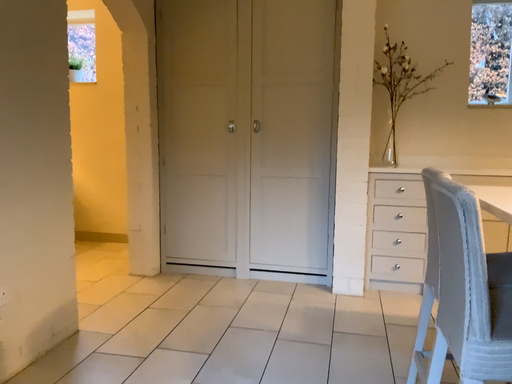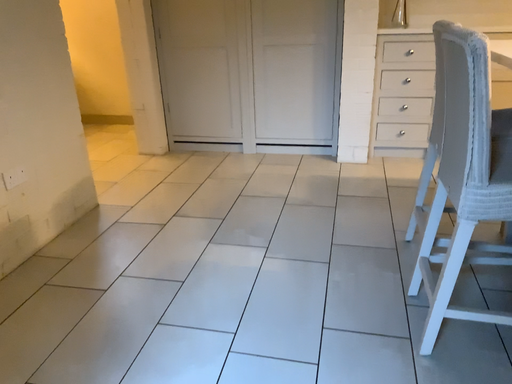
Question: How did the camera likely rotate when shooting the video?

Choices:
 (A) rotated downward
 (B) rotated upward

Answer: (A)